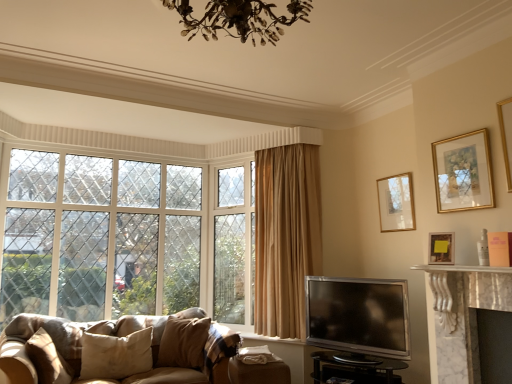
Question: Considering the relative sizes of black glass tv stand at lower center and wooden picture frame at upper right, the first picture frame when ordered from back to front, in the image provided, is black glass tv stand at lower center smaller than wooden picture frame at upper right, the first picture frame when ordered from back to front,?

Choices:
 (A) yes
 (B) no

Answer: (B)

Question: Is black glass tv stand at lower center beside wooden picture frame at upper right, the first picture frame when ordered from back to front?

Choices:
 (A) yes
 (B) no

Answer: (B)

Question: Does black glass tv stand at lower center have a greater width compared to wooden picture frame at upper right, the first picture frame when ordered from back to front?

Choices:
 (A) yes
 (B) no

Answer: (A)

Question: From the image's perspective, does black glass tv stand at lower center appear lower than wooden picture frame at upper right, which is the 3th picture frame from front to back?

Choices:
 (A) no
 (B) yes

Answer: (B)

Question: Is black glass tv stand at lower center bigger than wooden picture frame at upper right, which is the 3th picture frame from front to back?

Choices:
 (A) yes
 (B) no

Answer: (A)

Question: Does black glass tv stand at lower center appear on the right side of wooden picture frame at upper right, which is the 3th picture frame from front to back?

Choices:
 (A) yes
 (B) no

Answer: (B)

Question: From the image's perspective, is clear glass window at left under silver metallic tv at lower right?

Choices:
 (A) no
 (B) yes

Answer: (A)

Question: Does clear glass window at left appear on the right side of silver metallic tv at lower right?

Choices:
 (A) no
 (B) yes

Answer: (A)

Question: Is clear glass window at left not within silver metallic tv at lower right?

Choices:
 (A) no
 (B) yes

Answer: (B)

Question: Could you tell me if clear glass window at left is facing silver metallic tv at lower right?

Choices:
 (A) yes
 (B) no

Answer: (A)

Question: Would you say silver metallic tv at lower right is part of clear glass window at left's contents?

Choices:
 (A) no
 (B) yes

Answer: (A)

Question: Can you see clear glass window at left touching silver metallic tv at lower right?

Choices:
 (A) yes
 (B) no

Answer: (B)

Question: Considering the relative sizes of beige fabric pillow at lower left, acting as the 1th pillow starting from the left, and velvet beige pillow at lower center, which ranks as the first pillow in right-to-left order, in the image provided, is beige fabric pillow at lower left, acting as the 1th pillow starting from the left, shorter than velvet beige pillow at lower center, which ranks as the first pillow in right-to-left order,?

Choices:
 (A) yes
 (B) no

Answer: (A)